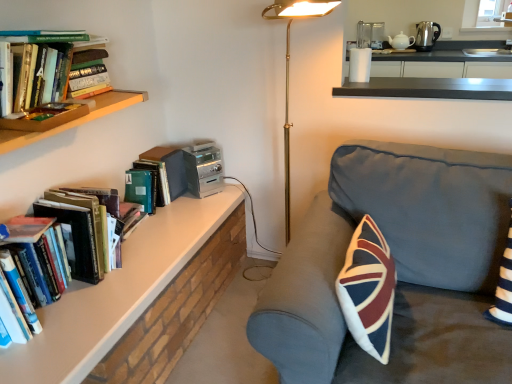
At what (x,y) coordinates should I click in order to perform the action: click on vacant space in between hardcover books at left, marked as the first book in a front-to-back arrangement, and silver metallic stereo at upper center, acting as the 1th appliance starting from the front. Please return your answer as a coordinate pair (x, y). The width and height of the screenshot is (512, 384). Looking at the image, I should click on (160, 236).